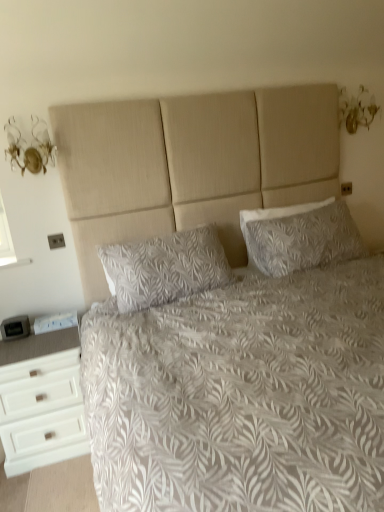
Question: Is white matte chest of drawers at lower left situated inside white textured pillow at upper right, acting as the second pillow starting from the left, or outside?

Choices:
 (A) outside
 (B) inside

Answer: (A)

Question: Considering the relative positions of white matte chest of drawers at lower left and white textured pillow at upper right, placed as the first pillow when sorted from right to left, in the image provided, is white matte chest of drawers at lower left to the left or to the right of white textured pillow at upper right, placed as the first pillow when sorted from right to left,?

Choices:
 (A) right
 (B) left

Answer: (B)

Question: Which object is positioned farthest from the white textured pillow at upper right, acting as the second pillow starting from the left?

Choices:
 (A) white leaf-patterned pillow at center, the second pillow in the right-to-left sequence
 (B) white matte chest of drawers at lower left
 (C) white textured bed at center

Answer: (B)

Question: Based on their relative distances, which object is farther from the white textured bed at center?

Choices:
 (A) white leaf-patterned pillow at center, placed as the first pillow when sorted from left to right
 (B) white textured pillow at upper right, placed as the first pillow when sorted from right to left
 (C) white matte chest of drawers at lower left

Answer: (C)